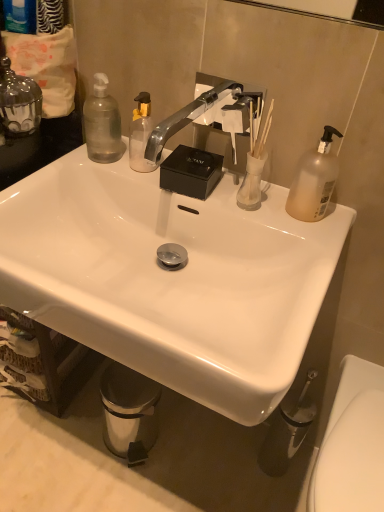
Question: Can you confirm if translucent glass vase at upper right is positioned to the left of transparent plastic bottle at upper left, acting as the 2th bottle starting from the right?

Choices:
 (A) yes
 (B) no

Answer: (B)

Question: Considering the relative sizes of translucent glass vase at upper right and transparent plastic bottle at upper left, acting as the 2th bottle starting from the right, in the image provided, is translucent glass vase at upper right thinner than transparent plastic bottle at upper left, acting as the 2th bottle starting from the right,?

Choices:
 (A) no
 (B) yes

Answer: (B)

Question: Is transparent plastic bottle at upper left, acting as the 2th bottle starting from the right, surrounded by translucent glass vase at upper right?

Choices:
 (A) yes
 (B) no

Answer: (B)

Question: Is translucent glass vase at upper right shorter than transparent plastic bottle at upper left, acting as the 2th bottle starting from the right?

Choices:
 (A) no
 (B) yes

Answer: (B)

Question: Is translucent glass vase at upper right next to transparent plastic bottle at upper left, arranged as the 2th bottle when viewed from the left?

Choices:
 (A) yes
 (B) no

Answer: (B)

Question: Considering the positions of translucent plastic pump bottle at upper right, acting as the 1th bottle starting from the right, and white glossy sink at center in the image, is translucent plastic pump bottle at upper right, acting as the 1th bottle starting from the right, taller or shorter than white glossy sink at center?

Choices:
 (A) tall
 (B) short

Answer: (B)

Question: Would you say translucent plastic pump bottle at upper right, acting as the 1th bottle starting from the right, is to the left or to the right of white glossy sink at center in the picture?

Choices:
 (A) right
 (B) left

Answer: (A)

Question: In terms of size, does translucent plastic pump bottle at upper right, the 3th bottle in the left-to-right sequence, appear bigger or smaller than white glossy sink at center?

Choices:
 (A) small
 (B) big

Answer: (A)

Question: Does point tap(289, 202) appear closer or farther from the camera than point tap(284, 247)?

Choices:
 (A) closer
 (B) farther

Answer: (B)

Question: Relative to metallic silver trash can at lower left, is transparent plastic bottle at upper left, arranged as the 2th bottle when viewed from the left, in front or behind?

Choices:
 (A) front
 (B) behind

Answer: (A)

Question: From a real-world perspective, is transparent plastic bottle at upper left, acting as the 2th bottle starting from the right, positioned above or below metallic silver trash can at lower left?

Choices:
 (A) below
 (B) above

Answer: (B)

Question: From their relative heights in the image, would you say transparent plastic bottle at upper left, acting as the 2th bottle starting from the right, is taller or shorter than metallic silver trash can at lower left?

Choices:
 (A) tall
 (B) short

Answer: (B)

Question: Considering the positions of point (94, 74) and point (117, 412), is point (94, 74) closer or farther from the camera than point (117, 412)?

Choices:
 (A) farther
 (B) closer

Answer: (B)

Question: Is point (122, 389) closer or farther from the camera than point (9, 74)?

Choices:
 (A) closer
 (B) farther

Answer: (B)

Question: Is metallic silver trash can at lower left wider or thinner than clear glass candle at upper left, the first bottle from the left?

Choices:
 (A) wide
 (B) thin

Answer: (A)